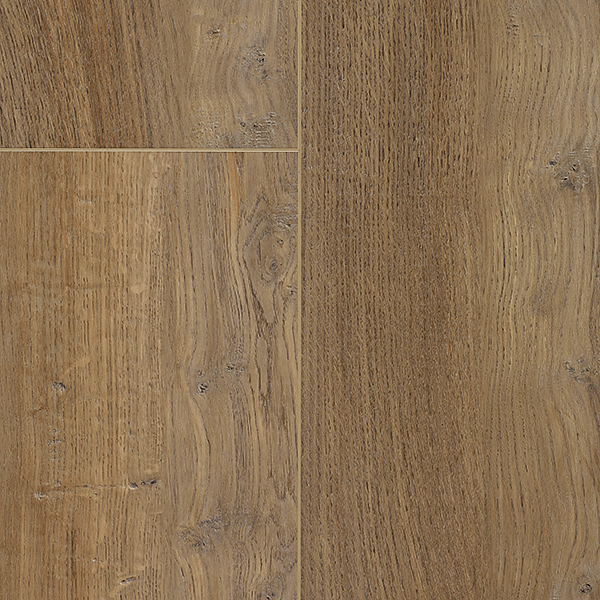
Image resolution: width=600 pixels, height=600 pixels. I want to click on wood grain, so click(x=37, y=67), click(x=43, y=115), click(x=88, y=122), click(x=90, y=75).